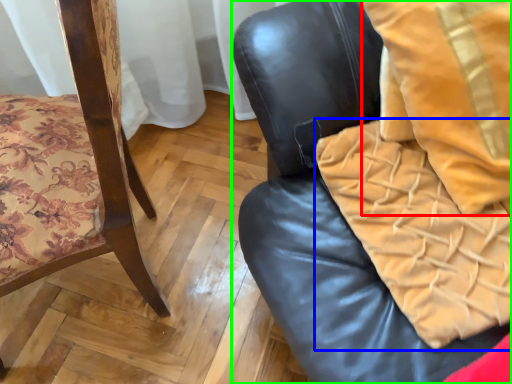
Question: Which object is the closest to the throw pillow (highlighted by a red box)? Choose among these: blanket (highlighted by a blue box) or chair (highlighted by a green box).

Choices:
 (A) blanket
 (B) chair

Answer: (A)